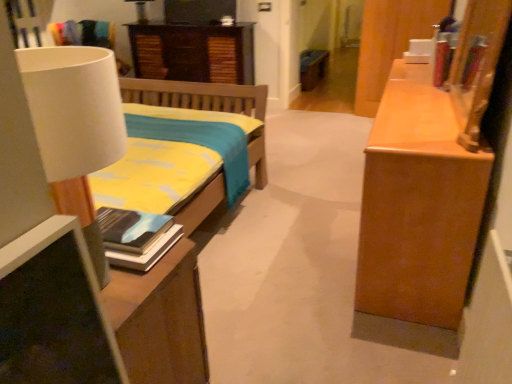
Question: Is white matte lamp at left, which is the second lamp from top to bottom, at the right side of hardcover book at left?

Choices:
 (A) no
 (B) yes

Answer: (A)

Question: Is the position of white matte lamp at left, which is the 1th lamp in front-to-back order, more distant than that of hardcover book at left?

Choices:
 (A) no
 (B) yes

Answer: (A)

Question: Is white matte lamp at left, which is the 1th lamp in front-to-back order, bigger than hardcover book at left?

Choices:
 (A) yes
 (B) no

Answer: (A)

Question: Considering the relative sizes of white matte lamp at left, arranged as the 1th lamp when ordered from the bottom, and hardcover book at left in the image provided, is white matte lamp at left, arranged as the 1th lamp when ordered from the bottom, taller than hardcover book at left?

Choices:
 (A) yes
 (B) no

Answer: (A)

Question: Can you confirm if white matte lamp at left, arranged as the 1th lamp when ordered from the bottom, is positioned to the left of hardcover book at left?

Choices:
 (A) no
 (B) yes

Answer: (B)

Question: Is white matte lamp at left, which appears as the 1th lamp when viewed from the right, taller or shorter than hardcover book at left?

Choices:
 (A) tall
 (B) short

Answer: (A)

Question: From the image's perspective, is white matte lamp at left, which is the 1th lamp in front-to-back order, positioned above or below hardcover book at left?

Choices:
 (A) below
 (B) above

Answer: (B)

Question: In terms of size, does white matte lamp at left, which is counted as the 2th lamp, starting from the back, appear bigger or smaller than hardcover book at left?

Choices:
 (A) small
 (B) big

Answer: (B)

Question: Is white matte lamp at left, which is the second lamp from top to bottom, situated inside hardcover book at left or outside?

Choices:
 (A) inside
 (B) outside

Answer: (B)

Question: Is point (71, 102) positioned closer to the camera than point (225, 77)?

Choices:
 (A) farther
 (B) closer

Answer: (B)

Question: In the image, is white matte lamp at left, which is the second lamp from top to bottom, positioned in front of or behind dark wood cabinet at upper center?

Choices:
 (A) behind
 (B) front

Answer: (B)

Question: Is white matte lamp at left, which is the second lamp in left-to-right order, inside the boundaries of dark wood cabinet at upper center, or outside?

Choices:
 (A) inside
 (B) outside

Answer: (B)

Question: Looking at their shapes, would you say white matte lamp at left, which is the 1th lamp in front-to-back order, is wider or thinner than dark wood cabinet at upper center?

Choices:
 (A) thin
 (B) wide

Answer: (A)

Question: Considering the positions of matte white lampshade at upper left, placed as the 1th lamp when sorted from top to bottom, and dark wood cabinet at upper center in the image, is matte white lampshade at upper left, placed as the 1th lamp when sorted from top to bottom, wider or thinner than dark wood cabinet at upper center?

Choices:
 (A) wide
 (B) thin

Answer: (B)

Question: Would you say matte white lampshade at upper left, which is the 2th lamp from bottom to top, is inside or outside dark wood cabinet at upper center?

Choices:
 (A) outside
 (B) inside

Answer: (A)